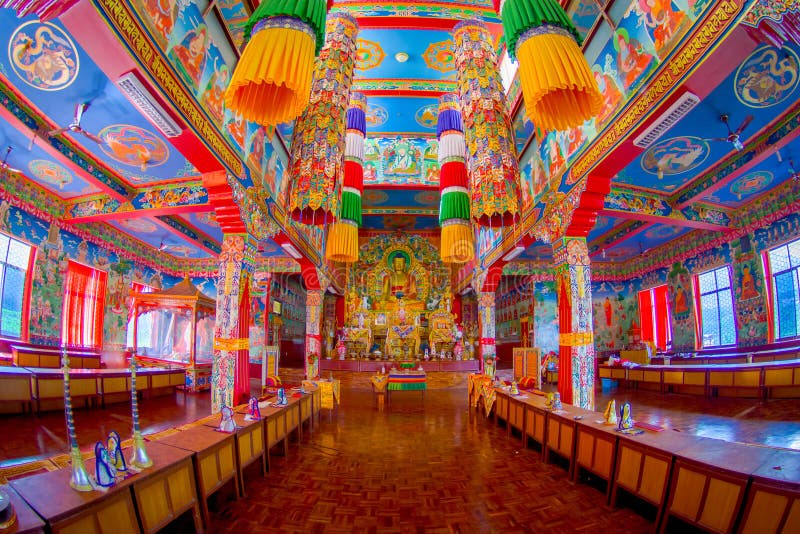
At what (x,y) coordinates should I click in order to perform the action: click on empty space on the floor. Please return your answer as a coordinate pair (x, y). Image resolution: width=800 pixels, height=534 pixels. Looking at the image, I should click on (424, 461).